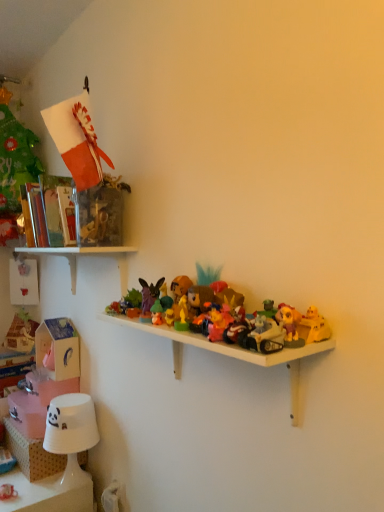
Question: From the image's perspective, is white plastic shelf at center, which is counted as the 2th shelf, starting from the bottom, on shiny plastic toy at center right, the fifth toy from the bottom?

Choices:
 (A) yes
 (B) no

Answer: (B)

Question: From the image's perspective, is white plastic shelf at center, which is counted as the 2th shelf, starting from the bottom, located beneath shiny plastic toy at center right, arranged as the 2th toy when viewed from the front?

Choices:
 (A) yes
 (B) no

Answer: (A)

Question: Can you confirm if white plastic shelf at center, which is counted as the 2th shelf, starting from the bottom, is taller than shiny plastic toy at center right, arranged as the 2th toy when viewed from the front?

Choices:
 (A) no
 (B) yes

Answer: (B)

Question: Could you tell me if white plastic shelf at center, the 2th shelf positioned from the top, is turned towards shiny plastic toy at center right, arranged as the 2th toy when viewed from the front?

Choices:
 (A) yes
 (B) no

Answer: (B)

Question: From a real-world perspective, is white plastic shelf at center, which is counted as the 2th shelf, starting from the bottom, located higher than shiny plastic toy at center right, arranged as the 2th toy when viewed from the front?

Choices:
 (A) yes
 (B) no

Answer: (B)

Question: Is white plastic shelf at center, the 2th shelf positioned from the top, turned away from shiny plastic toy at center right, which is the 7th toy from back to front?

Choices:
 (A) no
 (B) yes

Answer: (A)

Question: Is smooth white lampshade at lower left, which is the 1th toy in back-to-front order, shorter than purple matte plush toy at center, placed as the second toy when sorted from left to right?

Choices:
 (A) yes
 (B) no

Answer: (A)

Question: Is smooth white lampshade at lower left, which is counted as the eighth toy, starting from the front, to the right of purple matte plush toy at center, which is the third toy from top to bottom, from the viewer's perspective?

Choices:
 (A) yes
 (B) no

Answer: (B)

Question: Considering the relative sizes of smooth white lampshade at lower left, which is the 1th toy in back-to-front order, and purple matte plush toy at center, the 6th toy in the bottom-to-top sequence, in the image provided, is smooth white lampshade at lower left, which is the 1th toy in back-to-front order, smaller than purple matte plush toy at center, the 6th toy in the bottom-to-top sequence,?

Choices:
 (A) no
 (B) yes

Answer: (A)

Question: Is smooth white lampshade at lower left, which is counted as the eighth toy, starting from the front, directly adjacent to purple matte plush toy at center, arranged as the seventh toy when viewed from the right?

Choices:
 (A) no
 (B) yes

Answer: (A)

Question: From a real-world perspective, is smooth white lampshade at lower left, positioned as the eighth toy in top-to-bottom order, located beneath purple matte plush toy at center, placed as the second toy when sorted from left to right?

Choices:
 (A) no
 (B) yes

Answer: (B)

Question: From the image's perspective, is smooth white lampshade at lower left, which is counted as the eighth toy, starting from the front, above purple matte plush toy at center, the 6th toy in the bottom-to-top sequence?

Choices:
 (A) yes
 (B) no

Answer: (B)

Question: Is white plastic shelf at center, which is counted as the 2th shelf, starting from the bottom, aimed at matte plastic toy at center, acting as the 1th toy starting from the top?

Choices:
 (A) yes
 (B) no

Answer: (B)